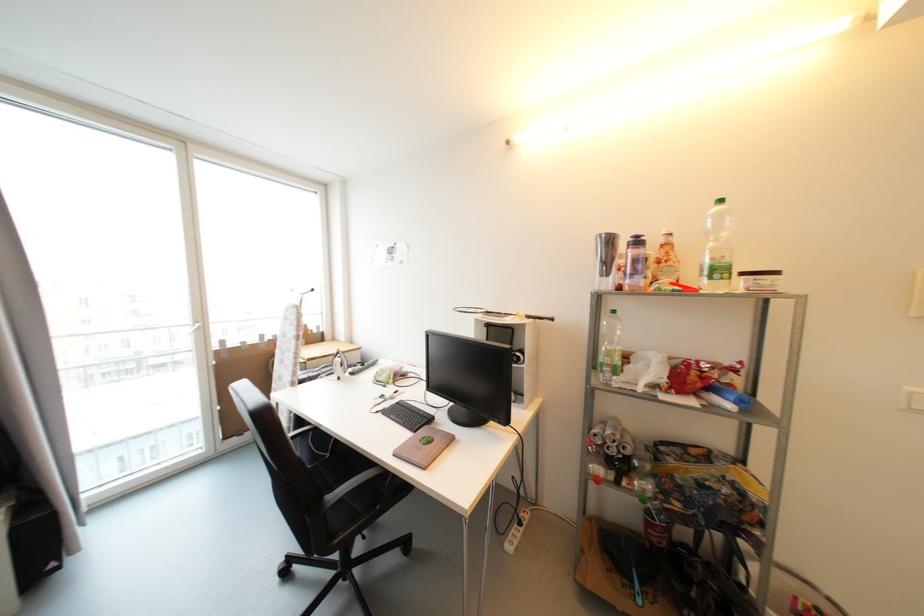
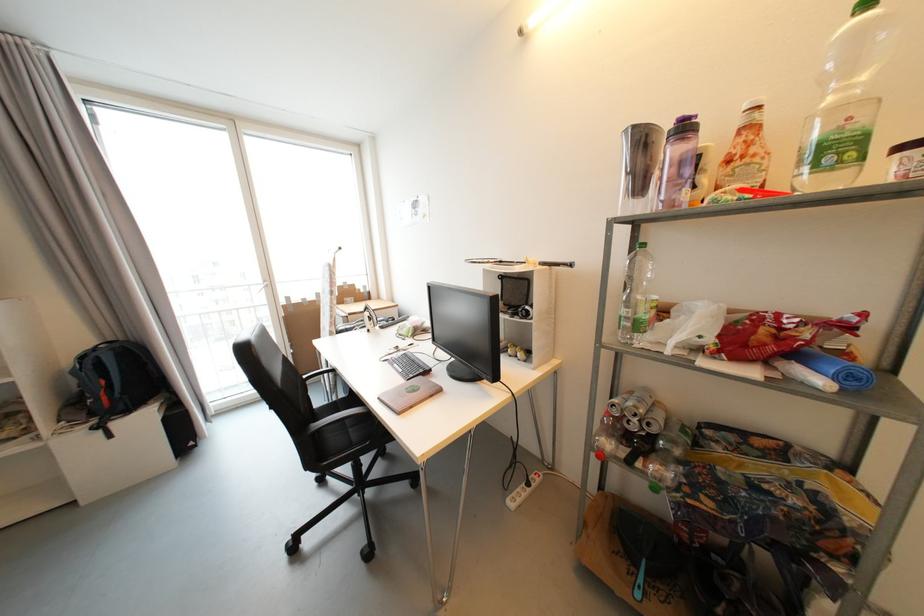
Question: The camera is either moving clockwise (left) or counter-clockwise (right) around the object. The first image is from the beginning of the video and the second image is from the end. Is the camera moving left or right when shooting the video?

Choices:
 (A) Left
 (B) Right

Answer: (B)